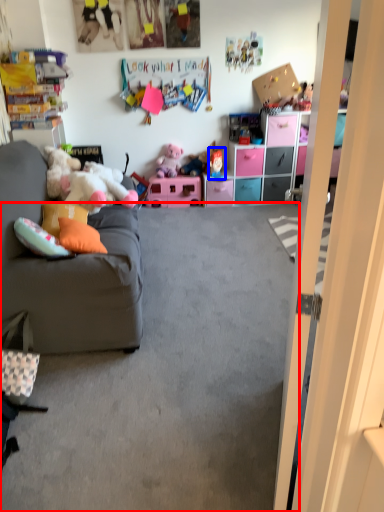
Question: Which object is further to the camera taking this photo, plain (highlighted by a red box) or toy (highlighted by a blue box)?

Choices:
 (A) plain
 (B) toy

Answer: (B)